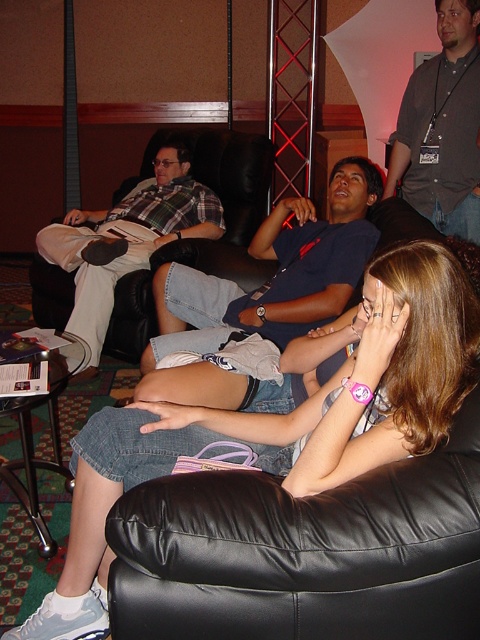
Does point (427, 433) lie in front of point (440, 195)?

Yes.

Can you confirm if denim skirt at lower left is positioned above dark gray shirt at upper right?

Incorrect, denim skirt at lower left is not positioned above dark gray shirt at upper right.

Between point (75, 440) and point (463, 218), which one is positioned behind?

The point (463, 218) is more distant.

Locate an element on the screen. This screenshot has width=480, height=640. denim skirt at lower left is located at coordinates (286, 420).

Does denim skirt at lower left appear on the left side of plaid fabric shirt at left?

Incorrect, denim skirt at lower left is not on the left side of plaid fabric shirt at left.

Is denim skirt at lower left to the right of plaid fabric shirt at left from the viewer's perspective?

Indeed, denim skirt at lower left is positioned on the right side of plaid fabric shirt at left.

Is point (342, 365) positioned after point (130, 257)?

No, (342, 365) is in front of (130, 257).

At what (x,y) coordinates should I click in order to perform the action: click on denim skirt at lower left. Please return your answer as a coordinate pair (x, y). This screenshot has height=640, width=480. Looking at the image, I should click on (286, 420).

Does dark gray shirt at upper right have a greater height compared to plaid fabric shirt at left?

In fact, dark gray shirt at upper right may be shorter than plaid fabric shirt at left.

Does dark gray shirt at upper right come in front of plaid fabric shirt at left?

Yes, it is in front of plaid fabric shirt at left.

Who is more forward, (460, 100) or (153, 163)?

Positioned in front is point (460, 100).

You are a GUI agent. You are given a task and a screenshot of the screen. Output one action in this format:
    pyautogui.click(x=<x>, y=<y>)
    Task: Click on the dark gray shirt at upper right
    The width and height of the screenshot is (480, 640).
    Given the screenshot: What is the action you would take?
    pyautogui.click(x=443, y=128)